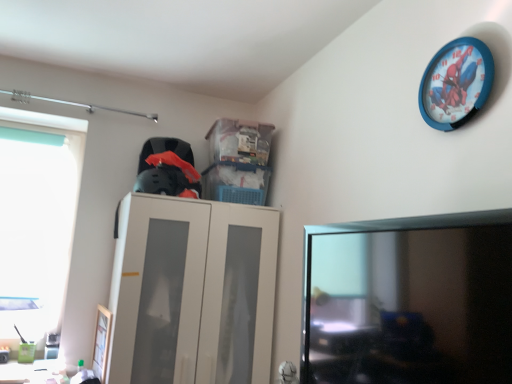
At what (x,y) coordinates should I click in order to perform the action: click on beige matte cabinet at center. Please return your answer as a coordinate pair (x, y). This screenshot has height=384, width=512. Looking at the image, I should click on (192, 292).

Describe the element at coordinates (102, 342) in the screenshot. I see `wooden picture frame at lower left` at that location.

Identify the location of black glossy monitor at lower right. (409, 300).

Locate an element on the screen. The image size is (512, 384). beige matte cabinet at center is located at coordinates (192, 292).

From the image's perspective, is beige matte cabinet at center on top of wooden picture frame at lower left?

Correct, beige matte cabinet at center appears higher than wooden picture frame at lower left in the image.

Considering the relative sizes of beige matte cabinet at center and wooden picture frame at lower left in the image provided, is beige matte cabinet at center thinner than wooden picture frame at lower left?

No.

Is beige matte cabinet at center completely or partially outside of wooden picture frame at lower left?

Yes, beige matte cabinet at center is not within wooden picture frame at lower left.

Is beige matte cabinet at center taller or shorter than wooden picture frame at lower left?

beige matte cabinet at center is taller than wooden picture frame at lower left.

Is point (15, 125) more distant than point (468, 92)?

Yes, point (15, 125) is farther from viewer.

Does transparent plastic window at left have a smaller size compared to blue plastic wall clock at upper right?

Actually, transparent plastic window at left might be larger than blue plastic wall clock at upper right.

Between transparent plastic window at left and blue plastic wall clock at upper right, which one is positioned behind?

transparent plastic window at left.

How different are the orientations of transparent plastic window at left and blue plastic wall clock at upper right in degrees?

transparent plastic window at left and blue plastic wall clock at upper right are facing 89.9 degrees away from each other.

Are blue plastic wall clock at upper right and wooden picture frame at lower left located far from each other?

Indeed, blue plastic wall clock at upper right is not near wooden picture frame at lower left.

From the image's perspective, between blue plastic wall clock at upper right and wooden picture frame at lower left, which one is located above?

blue plastic wall clock at upper right.

In the scene shown: Considering the sizes of objects blue plastic wall clock at upper right and wooden picture frame at lower left in the image provided, who is thinner, blue plastic wall clock at upper right or wooden picture frame at lower left?

Thinner between the two is wooden picture frame at lower left.

Is point (454, 98) closer to camera compared to point (100, 314)?

That is True.

Is transparent plastic window at left completely or partially outside of beige matte cabinet at center?

That's correct, transparent plastic window at left is outside of beige matte cabinet at center.

Considering the sizes of objects transparent plastic window at left and beige matte cabinet at center in the image provided, who is smaller, transparent plastic window at left or beige matte cabinet at center?

transparent plastic window at left.

From the image's perspective, is transparent plastic window at left located beneath beige matte cabinet at center?

No, from the image's perspective, transparent plastic window at left is not beneath beige matte cabinet at center.

Could you tell me if transparent plastic window at left is turned towards beige matte cabinet at center?

No, transparent plastic window at left is not facing towards beige matte cabinet at center.

From the image's perspective, which one is positioned higher, wooden picture frame at lower left or blue plastic wall clock at upper right?

blue plastic wall clock at upper right.

Considering the sizes of wooden picture frame at lower left and blue plastic wall clock at upper right in the image, is wooden picture frame at lower left taller or shorter than blue plastic wall clock at upper right?

wooden picture frame at lower left is taller than blue plastic wall clock at upper right.

From a real-world perspective, is wooden picture frame at lower left above or below blue plastic wall clock at upper right?

wooden picture frame at lower left is situated lower than blue plastic wall clock at upper right in the real world.

Does wooden picture frame at lower left have a greater width compared to blue plastic wall clock at upper right?

Incorrect, the width of wooden picture frame at lower left does not surpass that of blue plastic wall clock at upper right.

Where is `computer monitor that is in front of the transparent plastic window at left`? The width and height of the screenshot is (512, 384). computer monitor that is in front of the transparent plastic window at left is located at coordinates (409, 300).

Which object is more forward, transparent plastic window at left or black glossy monitor at lower right?

black glossy monitor at lower right is in front.

Can you confirm if transparent plastic window at left is wider than black glossy monitor at lower right?

No.

Between beige matte cabinet at center and black glossy monitor at lower right, which one has smaller size?

Smaller between the two is black glossy monitor at lower right.

From a real-world perspective, is beige matte cabinet at center positioned above or below black glossy monitor at lower right?

In terms of real-world spatial position, beige matte cabinet at center is below black glossy monitor at lower right.

This screenshot has width=512, height=384. Identify the location of cabinetry that is behind the black glossy monitor at lower right. (192, 292).

In the image, is beige matte cabinet at center positioned in front of or behind black glossy monitor at lower right?

Visually, beige matte cabinet at center is located behind black glossy monitor at lower right.

You are a GUI agent. You are given a task and a screenshot of the screen. Output one action in this format:
    pyautogui.click(x=<x>, y=<y>)
    Task: Click on the picture frame below the beige matte cabinet at center (from a real-world perspective)
    
    Given the screenshot: What is the action you would take?
    pyautogui.click(x=102, y=342)

Where is `window that appears below the blue plastic wall clock at upper right (from the image's perspective)`? This screenshot has width=512, height=384. window that appears below the blue plastic wall clock at upper right (from the image's perspective) is located at coordinates (37, 219).

When comparing their distances from transparent plastic window at left, does wooden picture frame at lower left or beige matte cabinet at center seem further?

Based on the image, beige matte cabinet at center appears to be further to transparent plastic window at left.

When comparing their distances from blue plastic wall clock at upper right, does black glossy monitor at lower right or wooden picture frame at lower left seem further?

wooden picture frame at lower left.

Looking at the image, which one is located further to transparent plastic window at left, beige matte cabinet at center or blue plastic wall clock at upper right?

Among the two, blue plastic wall clock at upper right is located further to transparent plastic window at left.

From the image, which object appears to be nearer to transparent plastic window at left, blue plastic wall clock at upper right or wooden picture frame at lower left?

wooden picture frame at lower left is positioned closer to the anchor transparent plastic window at left.

Which object lies further to the anchor point blue plastic wall clock at upper right, wooden picture frame at lower left or black glossy monitor at lower right?

wooden picture frame at lower left is positioned further to the anchor blue plastic wall clock at upper right.

Based on their spatial positions, is transparent plastic window at left or blue plastic wall clock at upper right further from beige matte cabinet at center?

blue plastic wall clock at upper right is further to beige matte cabinet at center.

Looking at the image, which one is located closer to transparent plastic window at left, blue plastic wall clock at upper right or beige matte cabinet at center?

beige matte cabinet at center is positioned closer to the anchor transparent plastic window at left.

When comparing their distances from transparent plastic window at left, does wooden picture frame at lower left or blue plastic wall clock at upper right seem closer?

wooden picture frame at lower left lies closer to transparent plastic window at left than the other object.

The image size is (512, 384). I want to click on cabinetry between black glossy monitor at lower right and transparent plastic window at left from front to back, so click(x=192, y=292).

This screenshot has height=384, width=512. What are the coordinates of `picture frame between transparent plastic window at left and blue plastic wall clock at upper right` in the screenshot? It's located at (102, 342).

This screenshot has height=384, width=512. What are the coordinates of `picture frame between black glossy monitor at lower right and transparent plastic window at left in the front-back direction` in the screenshot? It's located at pyautogui.click(x=102, y=342).

You are a GUI agent. You are given a task and a screenshot of the screen. Output one action in this format:
    pyautogui.click(x=<x>, y=<y>)
    Task: Click on the picture frame located between transparent plastic window at left and beige matte cabinet at center in the left-right direction
    This screenshot has width=512, height=384.
    Given the screenshot: What is the action you would take?
    pyautogui.click(x=102, y=342)